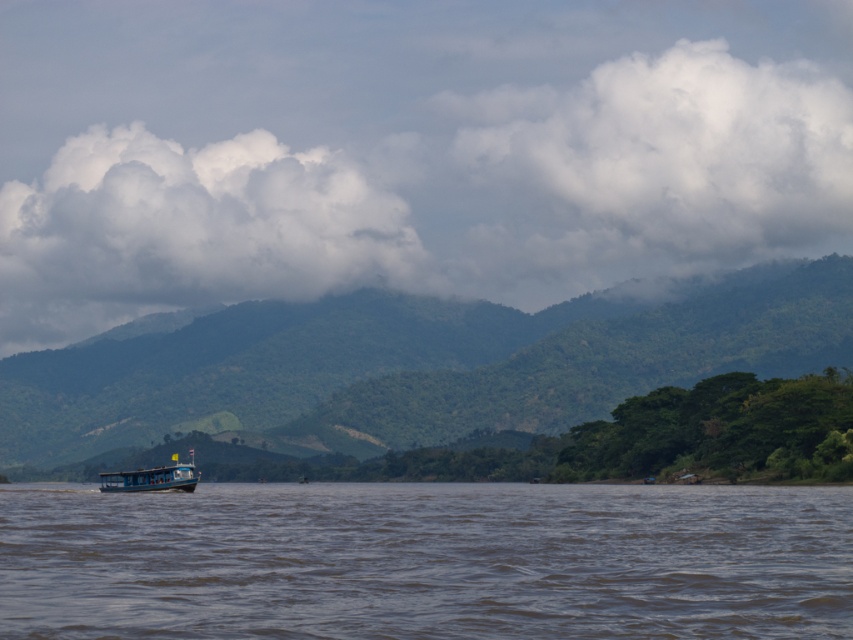
Question: Which object is the farthest from the blue wooden boat at center?

Choices:
 (A) green leafy forest at center
 (B) brown muddy water at lower center

Answer: (A)

Question: Does brown muddy water at lower center lie behind blue wooden boat at center?

Choices:
 (A) no
 (B) yes

Answer: (A)

Question: Among these objects, which one is nearest to the camera?

Choices:
 (A) green leafy forest at center
 (B) blue wooden boat at center

Answer: (B)

Question: Which of the following is the closest to the observer?

Choices:
 (A) blue wooden boat at center
 (B) brown muddy water at lower center
 (C) green leafy forest at center

Answer: (B)

Question: Is brown muddy water at lower center smaller than blue wooden boat at center?

Choices:
 (A) no
 (B) yes

Answer: (A)

Question: Can you confirm if brown muddy water at lower center is positioned to the right of green leafy forest at center?

Choices:
 (A) no
 (B) yes

Answer: (B)